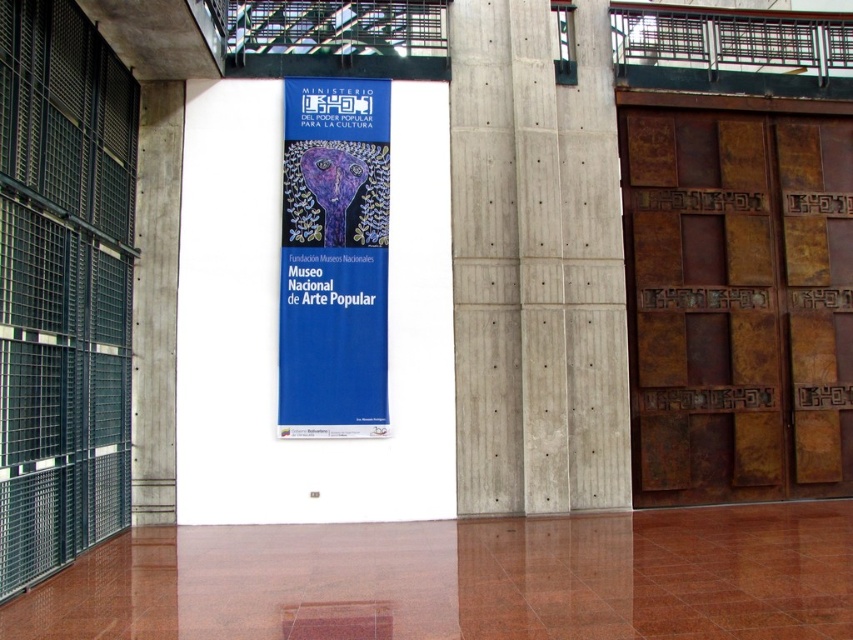
Can you confirm if concrete at center is positioned to the left of blue matte poster at center?

No, concrete at center is not to the left of blue matte poster at center.

Is point (485, 300) in front of point (293, 237)?

No, it is not.

Locate an element on the screen. The image size is (853, 640). concrete at center is located at coordinates (535, 266).

Who is positioned more to the right, rusty metal door at right or concrete at center?

Positioned to the right is rusty metal door at right.

Does rusty metal door at right appear under concrete at center?

No, rusty metal door at right is not below concrete at center.

What do you see at coordinates (738, 301) in the screenshot?
I see `rusty metal door at right` at bounding box center [738, 301].

You are a GUI agent. You are given a task and a screenshot of the screen. Output one action in this format:
    pyautogui.click(x=<x>, y=<y>)
    Task: Click on the rusty metal door at right
    The width and height of the screenshot is (853, 640).
    Given the screenshot: What is the action you would take?
    pyautogui.click(x=738, y=301)

Does rusty metal door at right have a greater width compared to blue matte poster at center?

Correct, the width of rusty metal door at right exceeds that of blue matte poster at center.

Which of these two, rusty metal door at right or blue matte poster at center, stands taller?

Standing taller between the two is rusty metal door at right.

Is point (770, 195) behind point (375, 138)?

That is True.

Where is `rusty metal door at right`? The height and width of the screenshot is (640, 853). rusty metal door at right is located at coordinates (738, 301).